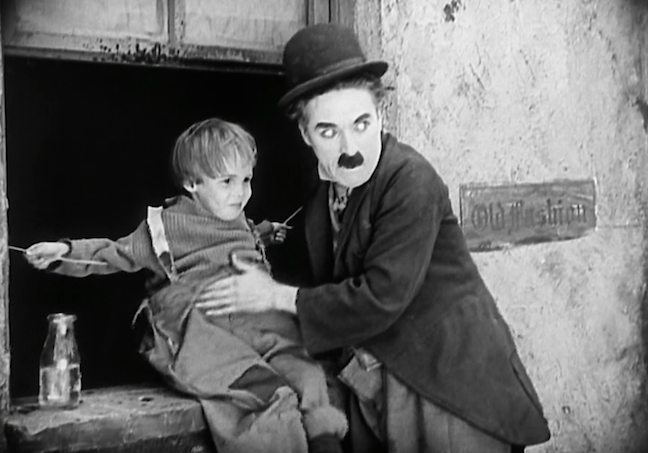
The image size is (648, 453). I want to click on wall, so click(x=481, y=83), click(x=201, y=28).